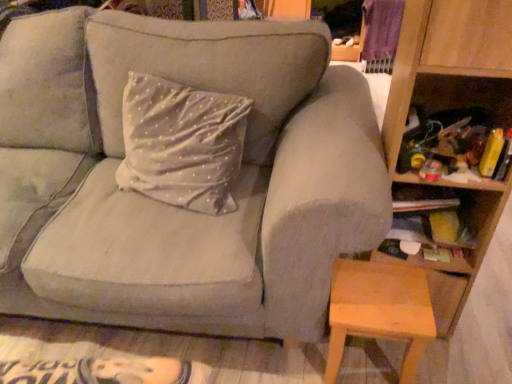
You are a GUI agent. You are given a task and a screenshot of the screen. Output one action in this format:
    pyautogui.click(x=<x>, y=<y>)
    Task: Click on the wooden bookshelf at right
    The image size is (512, 384).
    Given the screenshot: What is the action you would take?
    pyautogui.click(x=452, y=107)

In order to click on wooden stool at lower right in this screenshot , I will do `click(379, 311)`.

Measure the distance between point (426, 303) and camera.

Point (426, 303) and camera are 3.85 feet apart.

The height and width of the screenshot is (384, 512). Find the location of `wooden bookshelf at right`. wooden bookshelf at right is located at coordinates (452, 107).

Where is `studio couch located in front of the wooden stool at lower right`? The width and height of the screenshot is (512, 384). studio couch located in front of the wooden stool at lower right is located at coordinates (182, 172).

From the image's perspective, which one is positioned higher, wooden stool at lower right or suede gray couch at center?

suede gray couch at center is shown above in the image.

Is point (330, 323) positioned before point (2, 83)?

Yes, point (330, 323) is in front of point (2, 83).

Is wooden stool at lower right facing towards suede gray couch at center?

Yes, wooden stool at lower right faces towards suede gray couch at center.

Can you confirm if suede gray couch at center is thinner than wooden bookshelf at right?

Incorrect, the width of suede gray couch at center is not less than that of wooden bookshelf at right.

From a real-world perspective, is suede gray couch at center located higher than wooden bookshelf at right?

Incorrect, from a real-world perspective, suede gray couch at center is lower than wooden bookshelf at right.

Who is bigger, suede gray couch at center or wooden bookshelf at right?

With larger size is suede gray couch at center.

From the image's perspective, does suede gray couch at center appear lower than wooden bookshelf at right?

No, from the image's perspective, suede gray couch at center is not below wooden bookshelf at right.

Visually, is suede gray couch at center positioned to the left or to the right of wooden stool at lower right?

From the image, it's evident that suede gray couch at center is to the left of wooden stool at lower right.

From their relative heights in the image, would you say suede gray couch at center is taller or shorter than wooden stool at lower right?

In the image, suede gray couch at center appears to be taller than wooden stool at lower right.

Could you tell me if suede gray couch at center is turned towards wooden stool at lower right?

No, suede gray couch at center does not turn towards wooden stool at lower right.

Where is `table that is on the right side of suede gray couch at center`? The image size is (512, 384). table that is on the right side of suede gray couch at center is located at coordinates tap(379, 311).

Considering the sizes of objects wooden bookshelf at right and suede gray couch at center in the image provided, who is bigger, wooden bookshelf at right or suede gray couch at center?

Bigger between the two is suede gray couch at center.

From the image's perspective, does wooden bookshelf at right appear higher than suede gray couch at center?

No, from the image's perspective, wooden bookshelf at right is not above suede gray couch at center.

What are the coordinates of `studio couch that is in front of the wooden bookshelf at right` in the screenshot? It's located at [182, 172].

Is point (492, 39) behind point (22, 111)?

That is False.

Considering the positions of objects wooden stool at lower right and wooden bookshelf at right in the image provided, who is in front, wooden stool at lower right or wooden bookshelf at right?

wooden bookshelf at right is in front.

Which of these two, wooden stool at lower right or wooden bookshelf at right, is thinner?

Thinner between the two is wooden stool at lower right.

Image resolution: width=512 pixels, height=384 pixels. Identify the location of bookshelf that is above the wooden stool at lower right (from a real-world perspective). (452, 107).

Looking at this image, looking at the image, does wooden stool at lower right seem bigger or smaller compared to wooden bookshelf at right?

wooden stool at lower right is smaller than wooden bookshelf at right.

From the image's perspective, who appears lower, wooden bookshelf at right or wooden stool at lower right?

wooden stool at lower right appears lower in the image.

This screenshot has width=512, height=384. I want to click on table on the left of wooden bookshelf at right, so click(379, 311).

Between point (454, 48) and point (373, 317), which one is positioned in front?

The point (454, 48) is more forward.

From a real-world perspective, is wooden bookshelf at right physically below wooden stool at lower right?

No, from a real-world perspective, wooden bookshelf at right is not beneath wooden stool at lower right.

What are the coordinates of `table behind the suede gray couch at center` in the screenshot? It's located at (379, 311).

Where is `bookshelf on the right of suede gray couch at center`? The image size is (512, 384). bookshelf on the right of suede gray couch at center is located at coordinates (452, 107).

From the picture: When comparing their distances from wooden stool at lower right, does wooden bookshelf at right or suede gray couch at center seem closer?

wooden bookshelf at right.

Estimate the real-world distances between objects in this image. Which object is further from wooden stool at lower right, suede gray couch at center or wooden bookshelf at right?

suede gray couch at center.

When comparing their distances from wooden bookshelf at right, does suede gray couch at center or wooden stool at lower right seem closer?

Based on the image, wooden stool at lower right appears to be nearer to wooden bookshelf at right.

Looking at the image, which one is located closer to wooden bookshelf at right, wooden stool at lower right or suede gray couch at center?

wooden stool at lower right is positioned closer to the anchor wooden bookshelf at right.

Considering their positions, is wooden bookshelf at right positioned closer to suede gray couch at center than wooden stool at lower right?

Based on the image, wooden stool at lower right appears to be nearer to suede gray couch at center.

Considering their positions, is wooden stool at lower right positioned closer to suede gray couch at center than wooden bookshelf at right?

Based on the image, wooden stool at lower right appears to be nearer to suede gray couch at center.

Locate an element on the screen. table between suede gray couch at center and wooden bookshelf at right is located at coordinates (379, 311).